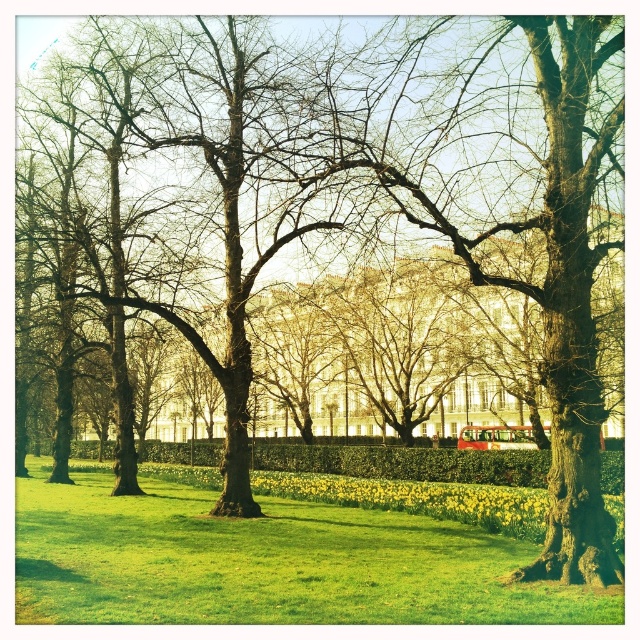
Question: Which point is closer to the camera?

Choices:
 (A) (435, 472)
 (B) (61, 592)

Answer: (B)

Question: Can you confirm if green grassy at center is positioned above green leafy hedge at center?

Choices:
 (A) yes
 (B) no

Answer: (A)

Question: Which point is closer to the camera taking this photo?

Choices:
 (A) (410, 566)
 (B) (461, 480)

Answer: (A)

Question: Is green grassy at center to the right of green leafy hedge at center from the viewer's perspective?

Choices:
 (A) yes
 (B) no

Answer: (B)

Question: Which point is closer to the camera taking this photo?

Choices:
 (A) (168, 531)
 (B) (401, 467)

Answer: (A)

Question: Is green grassy at center above green leafy hedge at center?

Choices:
 (A) no
 (B) yes

Answer: (B)